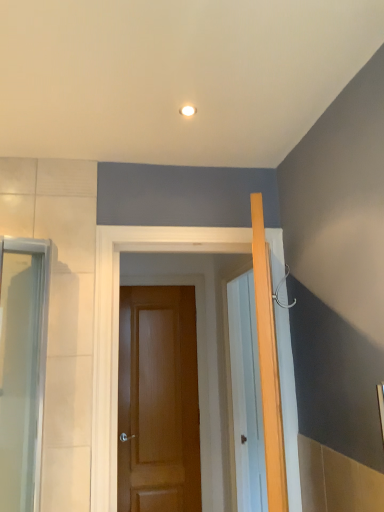
This screenshot has width=384, height=512. In order to click on brown wooden door at center, which appears as the second door when viewed from the back in this screenshot , I will do `click(118, 328)`.

What do you see at coordinates (23, 372) in the screenshot?
I see `clear glass screen door at left` at bounding box center [23, 372].

How much space does glossy wood door at center, marked as the second door in a front-to-back arrangement, occupy horizontally?

It is 2.86 inches.

You are a GUI agent. You are given a task and a screenshot of the screen. Output one action in this format:
    pyautogui.click(x=<x>, y=<y>)
    Task: Click on the brown wooden door at center, which appears as the second door when viewed from the back
    The width and height of the screenshot is (384, 512).
    Given the screenshot: What is the action you would take?
    (118, 328)

Considering the points (15, 458) and (170, 341), which point is behind, point (15, 458) or point (170, 341)?

The point (170, 341) is more distant.

From a real-world perspective, does clear glass screen door at left sit lower than glossy wood door at center, marked as the second door in a front-to-back arrangement?

Incorrect, from a real-world perspective, clear glass screen door at left is higher than glossy wood door at center, marked as the second door in a front-to-back arrangement.

Considering the relative sizes of clear glass screen door at left and glossy wood door at center, marked as the second door in a front-to-back arrangement, in the image provided, is clear glass screen door at left thinner than glossy wood door at center, marked as the second door in a front-to-back arrangement,?

No.

Which object is closer to the camera, clear glass screen door at left or glossy wood door at center, marked as the second door in a front-to-back arrangement?

Positioned in front is clear glass screen door at left.

Considering the relative sizes of clear glass screen door at left and brown wooden door at center, which is the first door in front-to-back order, in the image provided, is clear glass screen door at left wider than brown wooden door at center, which is the first door in front-to-back order,?

Yes, clear glass screen door at left is wider than brown wooden door at center, which is the first door in front-to-back order.

From the clear glass screen door at left, count 1st doors backward and point to it. Please provide its 2D coordinates.

[(118, 328)]

Considering the sizes of objects clear glass screen door at left and brown wooden door at center, which appears as the second door when viewed from the back, in the image provided, who is bigger, clear glass screen door at left or brown wooden door at center, which appears as the second door when viewed from the back,?

brown wooden door at center, which appears as the second door when viewed from the back.

Would you say brown wooden door at center, which is the first door in front-to-back order, is inside or outside glossy wood door at center, marked as the second door in a front-to-back arrangement?

brown wooden door at center, which is the first door in front-to-back order, is spatially situated outside glossy wood door at center, marked as the second door in a front-to-back arrangement.

Find the location of `door on the right of the glossy wood door at center, marked as the second door in a front-to-back arrangement`. door on the right of the glossy wood door at center, marked as the second door in a front-to-back arrangement is located at coordinates pos(118,328).

Is the surface of brown wooden door at center, which is the first door in front-to-back order, in direct contact with glossy wood door at center, positioned as the 1th door in back-to-front order?

No, brown wooden door at center, which is the first door in front-to-back order, is not beside glossy wood door at center, positioned as the 1th door in back-to-front order.

Is brown wooden door at center, which is the first door in front-to-back order, oriented away from glossy wood door at center, positioned as the 1th door in back-to-front order?

Yes.

Locate an element on the screen. This screenshot has height=512, width=384. door behind the brown wooden door at center, which appears as the second door when viewed from the back is located at coordinates (158, 401).

Are glossy wood door at center, positioned as the 1th door in back-to-front order, and brown wooden door at center, which appears as the second door when viewed from the back, beside each other?

glossy wood door at center, positioned as the 1th door in back-to-front order, is not next to brown wooden door at center, which appears as the second door when viewed from the back, and they're not touching.

Can we say glossy wood door at center, marked as the second door in a front-to-back arrangement, lies outside brown wooden door at center, which is the first door in front-to-back order?

Yes, glossy wood door at center, marked as the second door in a front-to-back arrangement, is outside of brown wooden door at center, which is the first door in front-to-back order.

From the image's perspective, is brown wooden door at center, which appears as the second door when viewed from the back, located above or below clear glass screen door at left?

brown wooden door at center, which appears as the second door when viewed from the back, is situated lower than clear glass screen door at left in the image.

Is brown wooden door at center, which appears as the second door when viewed from the back, oriented away from clear glass screen door at left?

No, clear glass screen door at left is not at the back of brown wooden door at center, which appears as the second door when viewed from the back.

Is brown wooden door at center, which is the first door in front-to-back order, far from clear glass screen door at left?

That's not correct — brown wooden door at center, which is the first door in front-to-back order, is a little close to clear glass screen door at left.

Between point (104, 498) and point (14, 248), which one is positioned in front?

The point (104, 498) is closer to the camera.

Image resolution: width=384 pixels, height=512 pixels. What are the coordinates of `door that is the 2nd object located below the clear glass screen door at left (from the image's perspective)` in the screenshot? It's located at (158, 401).

How far apart are glossy wood door at center, marked as the second door in a front-to-back arrangement, and clear glass screen door at left?

glossy wood door at center, marked as the second door in a front-to-back arrangement, is 5.24 feet from clear glass screen door at left.

Can you see glossy wood door at center, positioned as the 1th door in back-to-front order, touching clear glass screen door at left?

No, glossy wood door at center, positioned as the 1th door in back-to-front order, is not in contact with clear glass screen door at left.

Between glossy wood door at center, positioned as the 1th door in back-to-front order, and clear glass screen door at left, which one appears on the left side from the viewer's perspective?

clear glass screen door at left.

From a real-world perspective, which door is the 2nd one underneath the clear glass screen door at left? Please provide its 2D coordinates.

[(158, 401)]

Which door is the 1st one when counting from the back of the clear glass screen door at left? Please provide its 2D coordinates.

[(118, 328)]

Looking at the image, which one is located closer to glossy wood door at center, positioned as the 1th door in back-to-front order, brown wooden door at center, which appears as the second door when viewed from the back, or clear glass screen door at left?

brown wooden door at center, which appears as the second door when viewed from the back, lies closer to glossy wood door at center, positioned as the 1th door in back-to-front order, than the other object.

When comparing their distances from glossy wood door at center, marked as the second door in a front-to-back arrangement, does clear glass screen door at left or brown wooden door at center, which appears as the second door when viewed from the back, seem further?

The object further to glossy wood door at center, marked as the second door in a front-to-back arrangement, is clear glass screen door at left.

Which object lies further to the anchor point clear glass screen door at left, brown wooden door at center, which is the first door in front-to-back order, or glossy wood door at center, marked as the second door in a front-to-back arrangement?

glossy wood door at center, marked as the second door in a front-to-back arrangement, lies further to clear glass screen door at left than the other object.

Considering their positions, is glossy wood door at center, positioned as the 1th door in back-to-front order, positioned further to clear glass screen door at left than brown wooden door at center, which is the first door in front-to-back order?

glossy wood door at center, positioned as the 1th door in back-to-front order, is positioned further to the anchor clear glass screen door at left.

Which object lies nearer to the anchor point brown wooden door at center, which appears as the second door when viewed from the back, glossy wood door at center, positioned as the 1th door in back-to-front order, or clear glass screen door at left?

clear glass screen door at left is positioned closer to the anchor brown wooden door at center, which appears as the second door when viewed from the back.

Estimate the real-world distances between objects in this image. Which object is further from brown wooden door at center, which appears as the second door when viewed from the back, clear glass screen door at left or glossy wood door at center, positioned as the 1th door in back-to-front order?

Based on the image, glossy wood door at center, positioned as the 1th door in back-to-front order, appears to be further to brown wooden door at center, which appears as the second door when viewed from the back.

Image resolution: width=384 pixels, height=512 pixels. Identify the location of door located between clear glass screen door at left and glossy wood door at center, positioned as the 1th door in back-to-front order, in the depth direction. (118, 328).